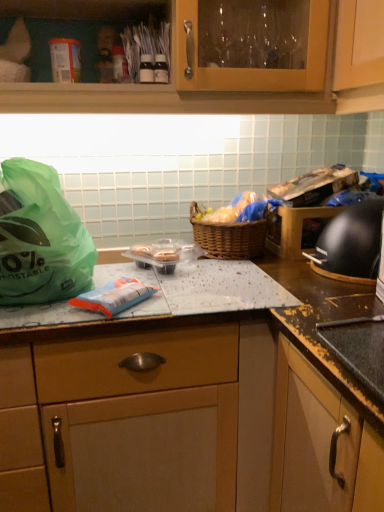
This screenshot has width=384, height=512. Find the location of `vacant position to the left of black matte gas stove at right`. vacant position to the left of black matte gas stove at right is located at coordinates (277, 278).